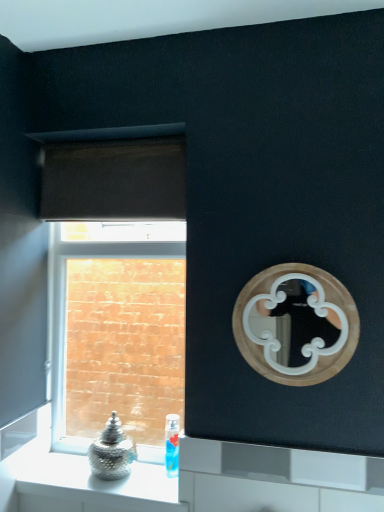
Question: Considering the positions of brown fabric curtain at upper left and brick textured wall at left in the image, is brown fabric curtain at upper left wider or thinner than brick textured wall at left?

Choices:
 (A) thin
 (B) wide

Answer: (A)

Question: From a real-world perspective, is brown fabric curtain at upper left physically located above or below brick textured wall at left?

Choices:
 (A) below
 (B) above

Answer: (B)

Question: Which object is positioned farthest from the metallic glass jar at lower left?

Choices:
 (A) brown fabric curtain at upper left
 (B) brick textured wall at left
 (C) translucent plastic bottle at lower center
 (D) wooden mirror at upper right

Answer: (B)

Question: Which of these objects is positioned closest to the brown fabric curtain at upper left?

Choices:
 (A) brick textured wall at left
 (B) wooden mirror at upper right
 (C) translucent plastic bottle at lower center
 (D) metallic glass jar at lower left

Answer: (B)